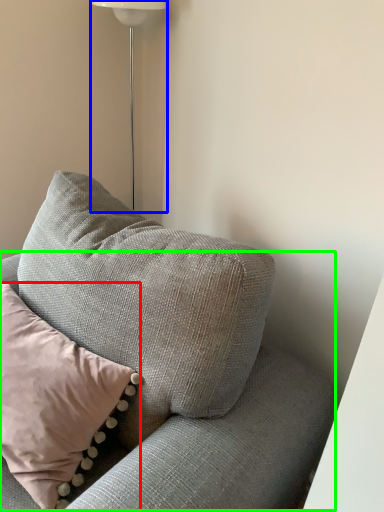
Question: Based on their relative distances, which object is nearer to pillow (highlighted by a red box)? Choose from lamp (highlighted by a blue box) and couch (highlighted by a green box).

Choices:
 (A) lamp
 (B) couch

Answer: (B)